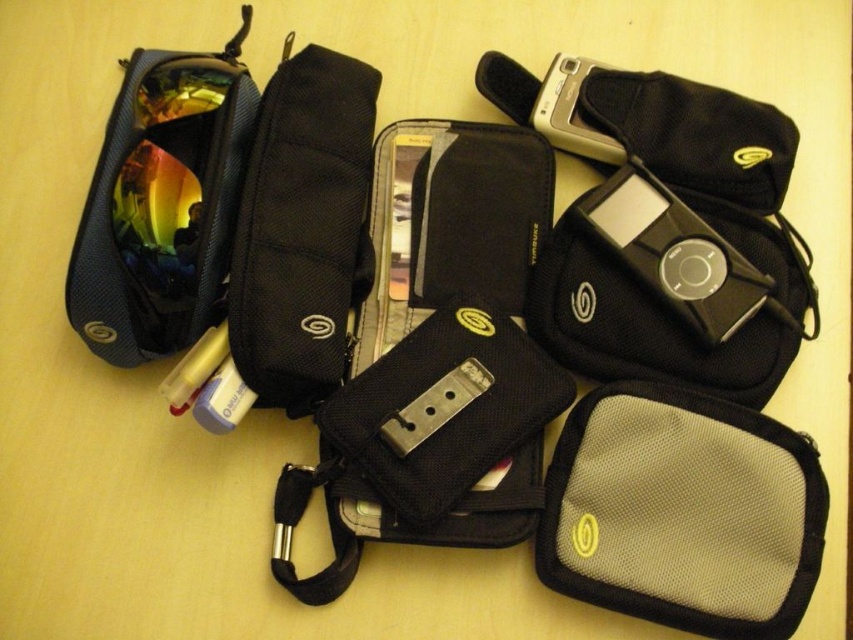
Can you confirm if matte black pouch at upper left is taller than silver metallic camera at upper right?

Correct, matte black pouch at upper left is much taller as silver metallic camera at upper right.

Measure the distance between matte black pouch at upper left and camera.

matte black pouch at upper left and camera are 1.21 meters apart.

You are a GUI agent. You are given a task and a screenshot of the screen. Output one action in this format:
    pyautogui.click(x=<x>, y=<y>)
    Task: Click on the matte black pouch at upper left
    The image size is (853, 640).
    Given the screenshot: What is the action you would take?
    pyautogui.click(x=161, y=202)

Does point (805, 452) come farther from viewer compared to point (601, 64)?

No, it is not.

Who is more forward, (558, 497) or (572, 60)?

Point (558, 497) is in front.

Describe the element at coordinates (683, 513) in the screenshot. I see `gray mesh pouch at lower right` at that location.

You are a GUI agent. You are given a task and a screenshot of the screen. Output one action in this format:
    pyautogui.click(x=<x>, y=<y>)
    Task: Click on the gray mesh pouch at lower right
    Image resolution: width=853 pixels, height=640 pixels.
    Given the screenshot: What is the action you would take?
    pyautogui.click(x=683, y=513)

Which is in front, point (91, 273) or point (325, 342)?

Point (91, 273) is more forward.

Can you confirm if matte black pouch at upper left is bigger than black fabric pouch at upper left?

Indeed, matte black pouch at upper left has a larger size compared to black fabric pouch at upper left.

At what (x,y) coordinates should I click in order to perform the action: click on matte black pouch at upper left. Please return your answer as a coordinate pair (x, y). This screenshot has height=640, width=853. Looking at the image, I should click on (161, 202).

You are a GUI agent. You are given a task and a screenshot of the screen. Output one action in this format:
    pyautogui.click(x=<x>, y=<y>)
    Task: Click on the matte black pouch at upper left
    
    Given the screenshot: What is the action you would take?
    pyautogui.click(x=161, y=202)